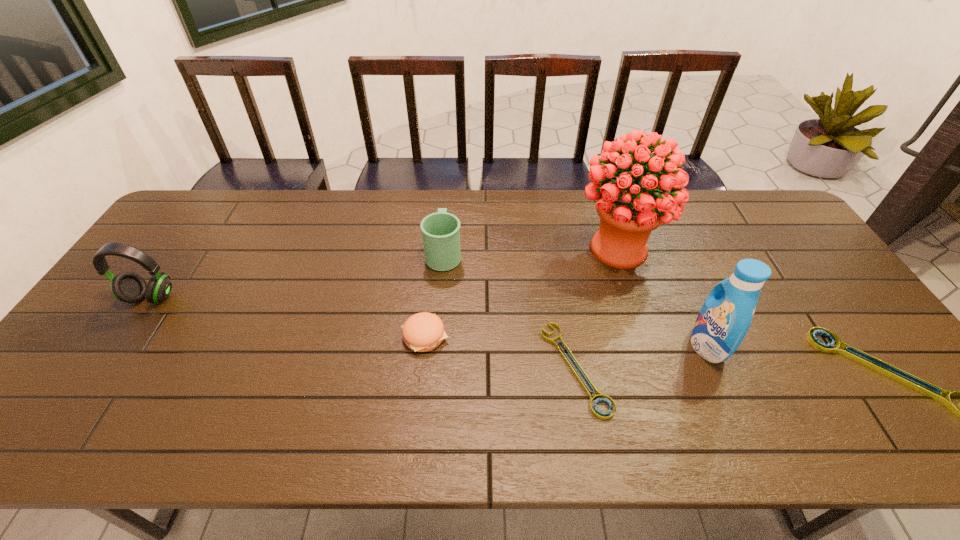
The height and width of the screenshot is (540, 960). I want to click on detergent that is at the near edge, so click(726, 315).

Image resolution: width=960 pixels, height=540 pixels. Identify the location of object that is at the left edge. (129, 287).

This screenshot has height=540, width=960. I want to click on free point at the far edge, so click(x=337, y=218).

The width and height of the screenshot is (960, 540). In order to click on vacant space at the near edge of the desktop in this screenshot , I will do `click(497, 377)`.

In the image, there is a desktop. Where is `free space at the left edge`? This screenshot has height=540, width=960. free space at the left edge is located at coordinates (113, 306).

Image resolution: width=960 pixels, height=540 pixels. I want to click on vacant space at the right edge, so click(852, 368).

Identify the location of free point between the fourth shortest object and the second tallest object. (575, 300).

The image size is (960, 540). I want to click on empty space that is in between the tallest object and the detergent, so click(662, 297).

Where is `empty space that is in between the patty and the mug`? This screenshot has width=960, height=540. empty space that is in between the patty and the mug is located at coordinates (434, 295).

Find the location of a particular element. This screenshot has height=540, width=960. vacant point located between the left wrench and the patty is located at coordinates (500, 352).